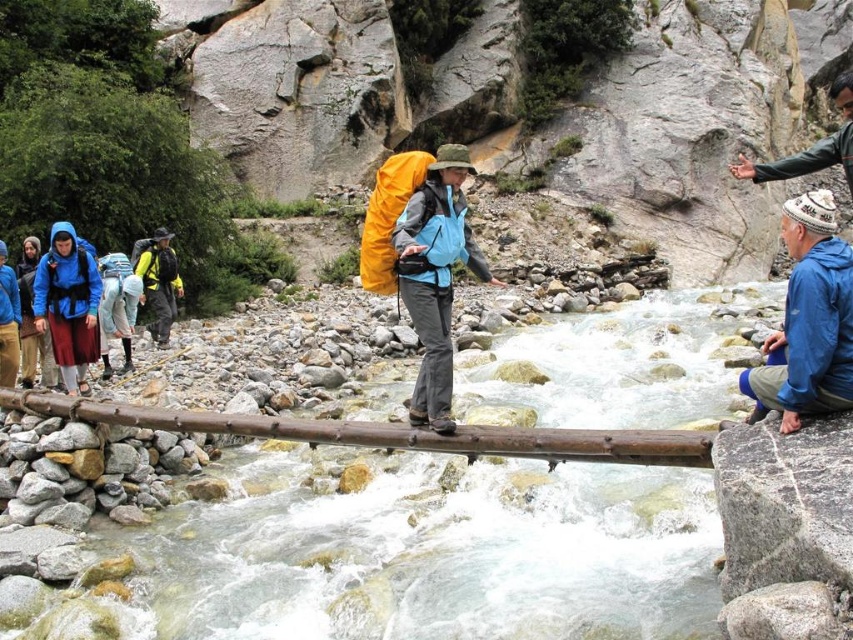
Question: Is brown wooden log at center above matte blue jacket at left?

Choices:
 (A) yes
 (B) no

Answer: (B)

Question: Which object is closer to the camera taking this photo?

Choices:
 (A) matte blue jacket at center
 (B) matte blue jacket at left
 (C) greenish-brown leather jacket at upper right
 (D) brown wooden log at center

Answer: (D)

Question: Can you confirm if brown wooden log at center is bigger than blue fleece jacket at lower right?

Choices:
 (A) yes
 (B) no

Answer: (A)

Question: Which point is closer to the camera?

Choices:
 (A) (38, 269)
 (B) (817, 168)
 (C) (424, 278)
 (D) (335, 586)

Answer: (D)

Question: In this image, where is matte blue jacket at center located relative to greenish-brown leather jacket at upper right?

Choices:
 (A) right
 (B) left

Answer: (B)

Question: Which object is positioned farthest from the matte blue jacket at center?

Choices:
 (A) blue fleece jacket at lower right
 (B) brown wooden log at center

Answer: (A)